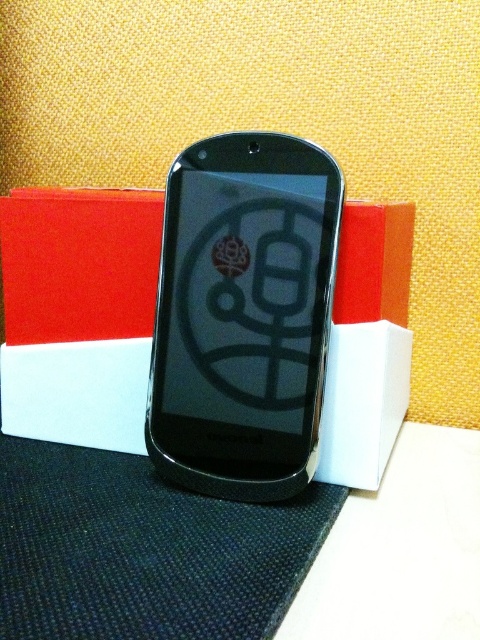
Question: Which of the following is the closest to the observer?

Choices:
 (A) black glossy smartphone at center
 (B) white cardboard box at center

Answer: (A)

Question: Observing the image, what is the correct spatial positioning of black glossy smartphone at center in reference to white cardboard box at center?

Choices:
 (A) below
 (B) above

Answer: (A)

Question: From the image, what is the correct spatial relationship of black glossy smartphone at center in relation to white cardboard box at center?

Choices:
 (A) above
 (B) below

Answer: (B)

Question: Which point is farther from the camera taking this photo?

Choices:
 (A) (1, 214)
 (B) (178, 328)

Answer: (A)

Question: Can you confirm if black glossy smartphone at center is positioned above white cardboard box at center?

Choices:
 (A) yes
 (B) no

Answer: (B)